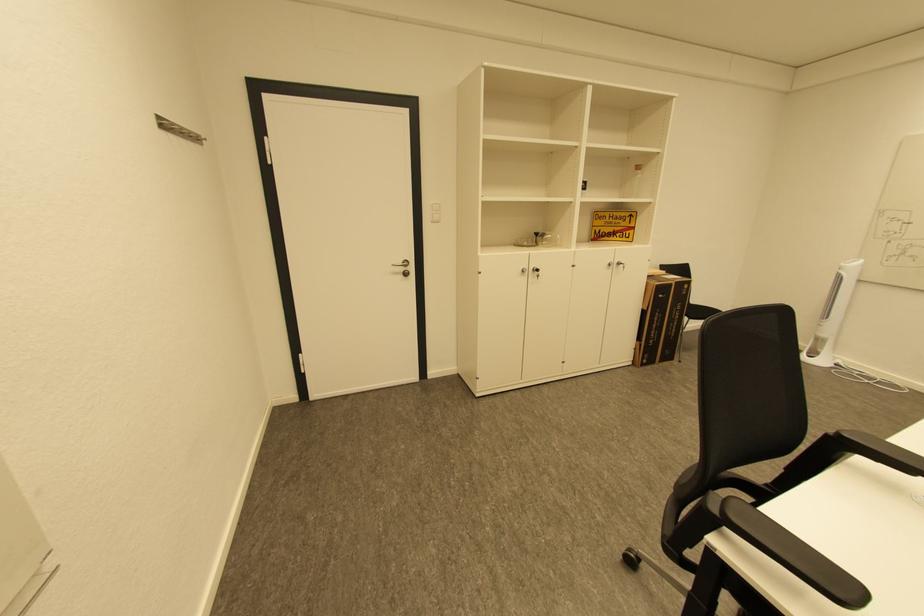
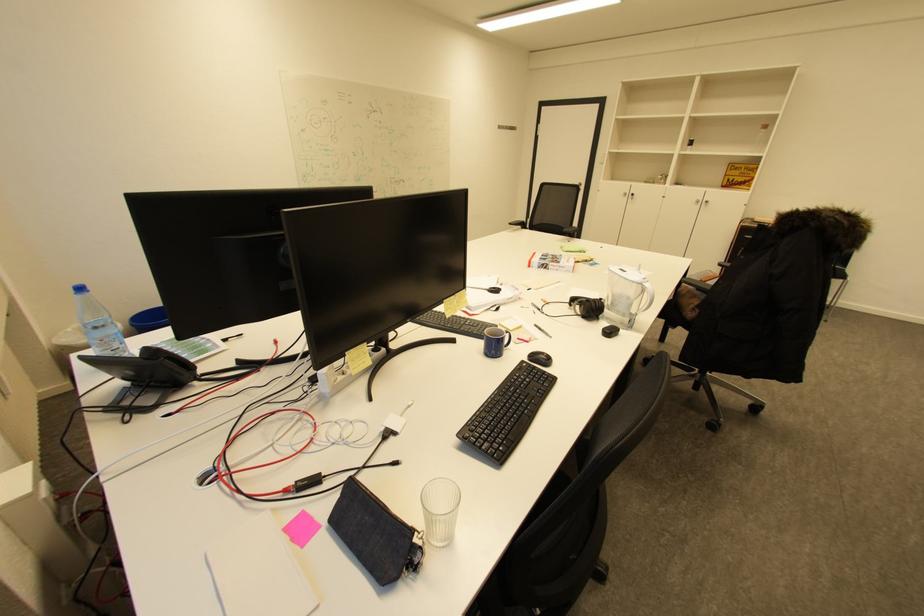
The point at (615, 265) is marked in the first image. Where is the corresponding point in the second image?

(703, 201)